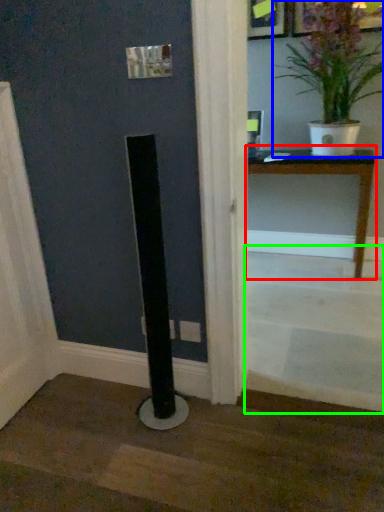
Question: Based on their relative distances, which object is farther from table (highlighted by a red box)? Choose from houseplant (highlighted by a blue box) and stairwell (highlighted by a green box).

Choices:
 (A) houseplant
 (B) stairwell

Answer: (B)